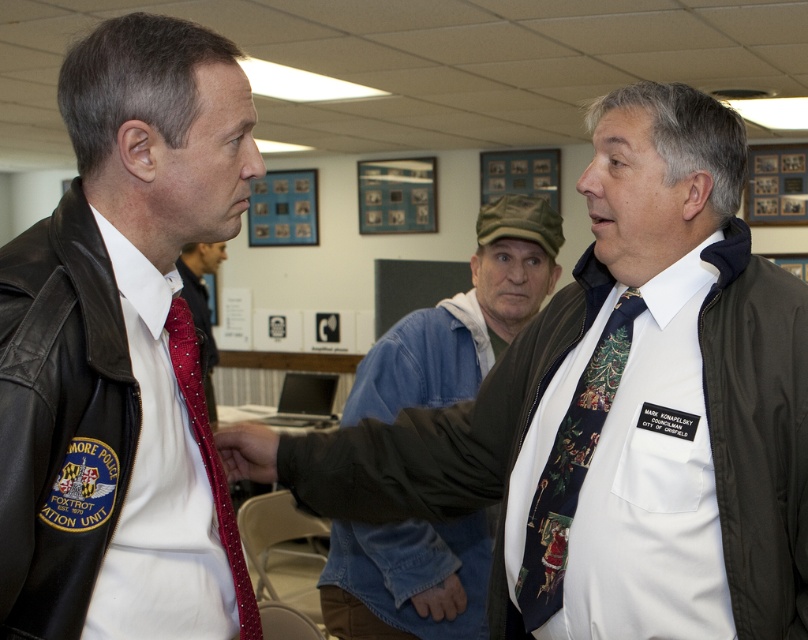
You are an interior designer observing the office scene. You notice the dark blue textured tie at center and the matte black hand at center. Which object is closer to you in the image?

The dark blue textured tie at center is closer to you because it is further to the viewer than the matte black hand at center.

You are a photographer standing at a distance of 5 feet from the dark blue textured tie at center. Can you capture the entire tie in your camera frame without moving closer?

The dark blue textured tie at center is 4.36 feet away from the camera. Since you are standing 5 feet away, you are farther than the tie, so you can capture the entire tie in your camera frame without moving closer.